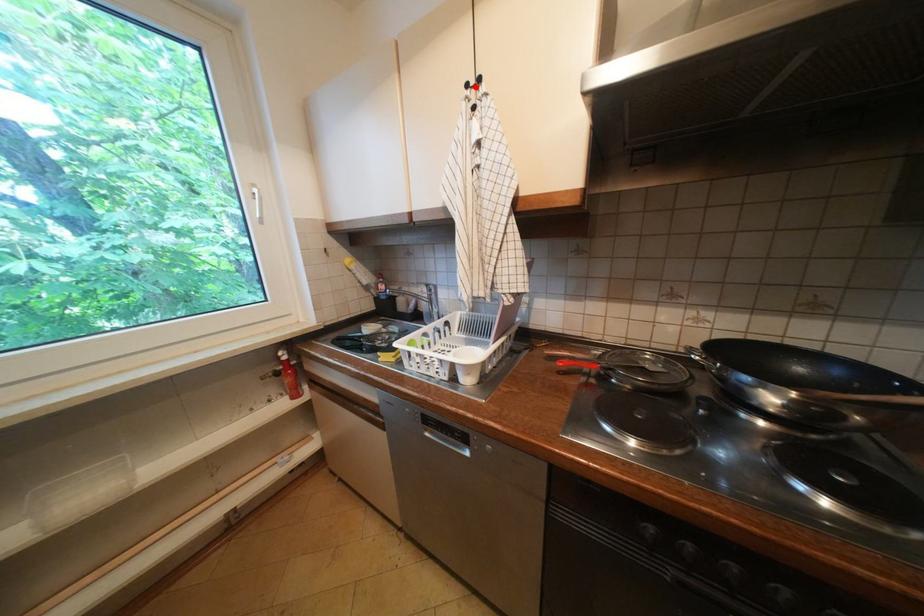
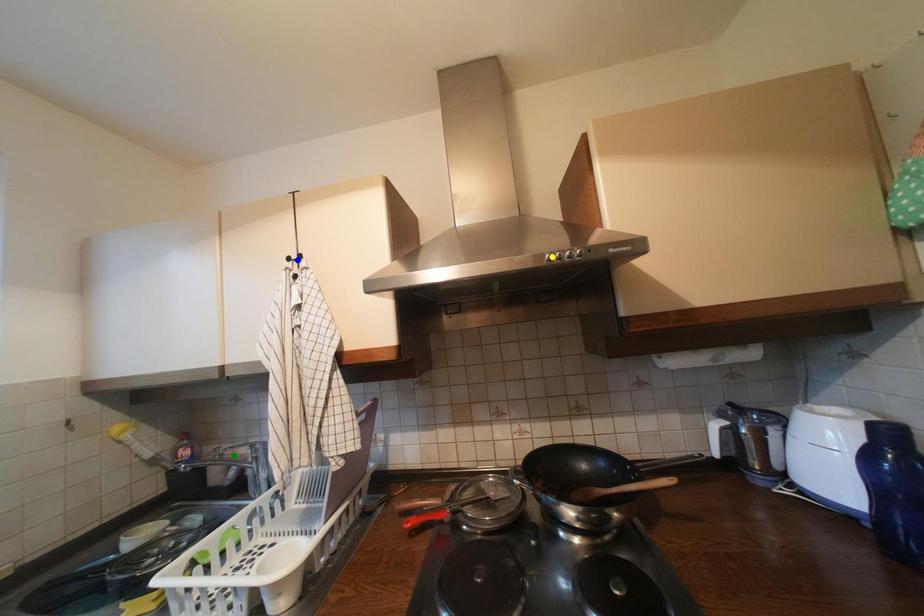
Question: I am providing you with two images of the same scene from different viewpoints. A red point is marked on the first image. You are given multiple points on the second image. Can you choose the point in image 2 that corresponds to the point in image 1?

Choices:
 (A) yellow point
 (B) blue point
 (C) green point

Answer: (B)